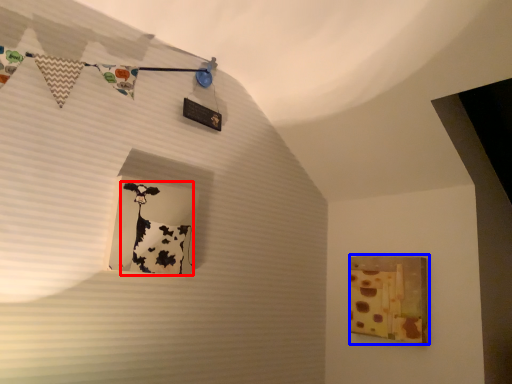
Question: Among these objects, which one is farthest to the camera, art (highlighted by a red box) or picture frame (highlighted by a blue box)?

Choices:
 (A) art
 (B) picture frame

Answer: (B)